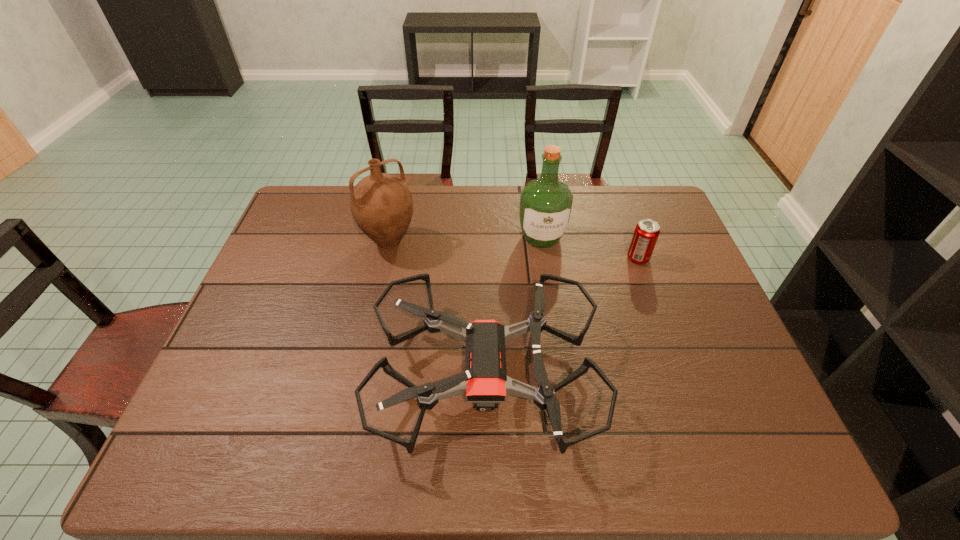
This screenshot has width=960, height=540. In order to click on vacant region between the nearest object and the rightmost object in this screenshot , I will do `click(562, 315)`.

Find the location of a particular element. empty space that is in between the pitcher and the soda can is located at coordinates (514, 250).

Identify the location of vacant space that's between the liquor and the drone. (514, 305).

What are the coordinates of `free spot between the nearest object and the pitcher` in the screenshot? It's located at (437, 307).

Identify the location of free space between the pitcher and the rightmost object. (514, 250).

Locate an element on the screen. This screenshot has width=960, height=540. free space between the soda can and the nearest object is located at coordinates (562, 315).

I want to click on empty space that is in between the rightmost object and the drone, so click(562, 315).

Identify the location of free space between the rightmost object and the pitcher. Image resolution: width=960 pixels, height=540 pixels. (514, 250).

Locate an element on the screen. The height and width of the screenshot is (540, 960). free space between the drone and the liquor is located at coordinates (514, 305).

You are a GUI agent. You are given a task and a screenshot of the screen. Output one action in this format:
    pyautogui.click(x=<x>, y=<y>)
    Task: Click on the object that ranks as the third closest to the rightmost object
    
    Given the screenshot: What is the action you would take?
    pyautogui.click(x=381, y=204)